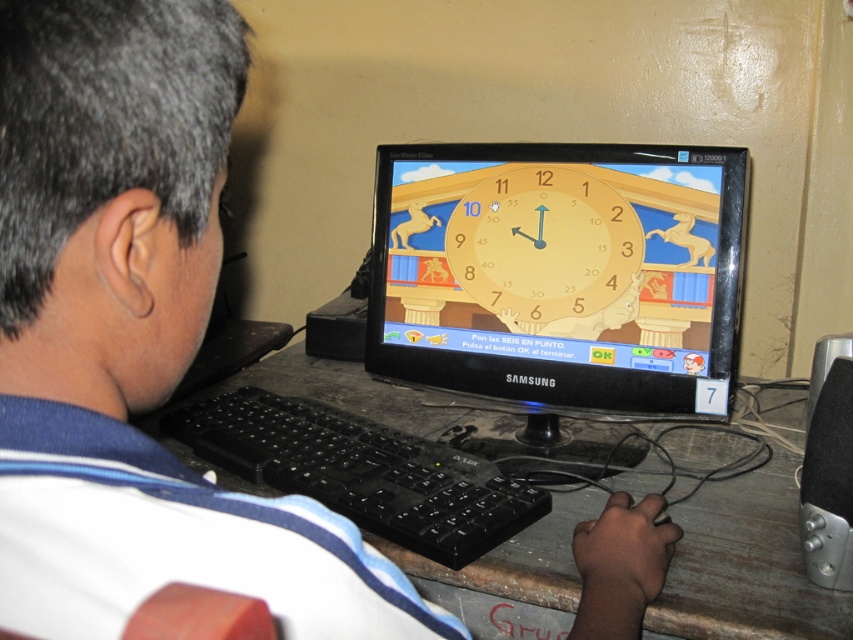
Which of these two, matte plastic monitor at center or wooden desk at center, stands shorter?

wooden desk at center is shorter.

Between point (717, 173) and point (688, 480), which one is positioned in front?

Point (717, 173)

Locate an element on the screen. The image size is (853, 640). matte plastic monitor at center is located at coordinates (560, 273).

Between wooden desk at center and yellow matte clock at center, which one appears on the left side from the viewer's perspective?

From the viewer's perspective, wooden desk at center appears more on the left side.

Who is more forward, (694, 452) or (585, 316)?

Positioned in front is point (585, 316).

Does point (396, 552) lie behind point (573, 330)?

No, it is in front of (573, 330).

Identify the location of wooden desk at center. [746, 564].

Consider the image. Can you confirm if black plastic keyboard at center is positioned below yellow matte clock at center?

Indeed, black plastic keyboard at center is positioned under yellow matte clock at center.

Is point (407, 525) behind point (503, 186)?

No, (407, 525) is in front of (503, 186).

Find the location of a particular element. The image size is (853, 640). black plastic keyboard at center is located at coordinates (361, 472).